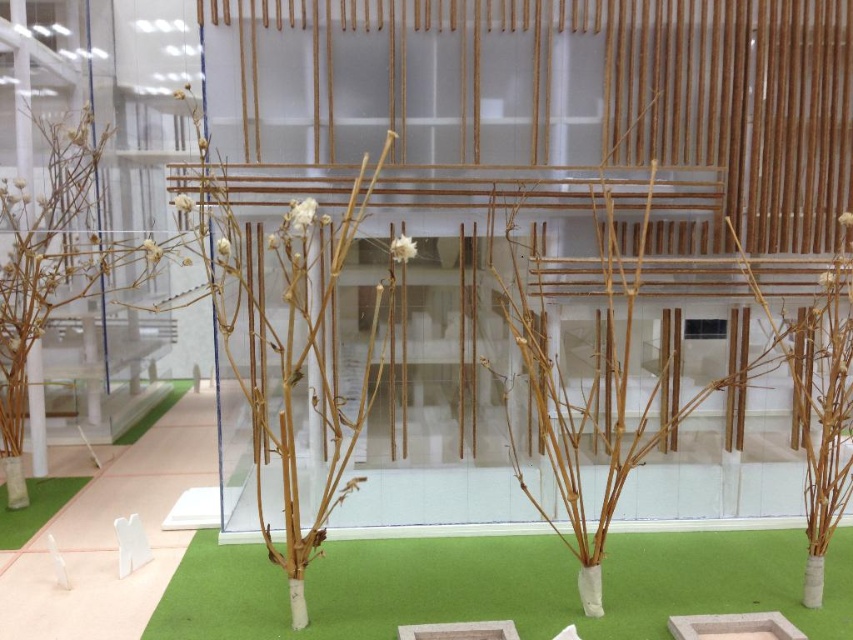
You are a museum curator planning to rearrange the display. You need to know which object occupies more horizontal space. Which one is wider between the brown matte branches at left and the green artificial grass at center?

The brown matte branches at left are wider than the green artificial grass at center, as stated in the description that the brown matte branches at left has a larger width.

You are a visitor standing in front of the glass enclosure and see both the green artificial grass at lower left and the green artificial grass at center. Which one is located to the left of the other?

The green artificial grass at lower left is positioned on the left side of green artificial grass at center.

You are a visitor at the museum and want to take a photo of the display. The green artificial turf at center and the bare wood branches at center are part of the exhibit. Which object is positioned lower in the image?

The green artificial turf at center is located below the bare wood branches at center, so it is positioned lower in the image.